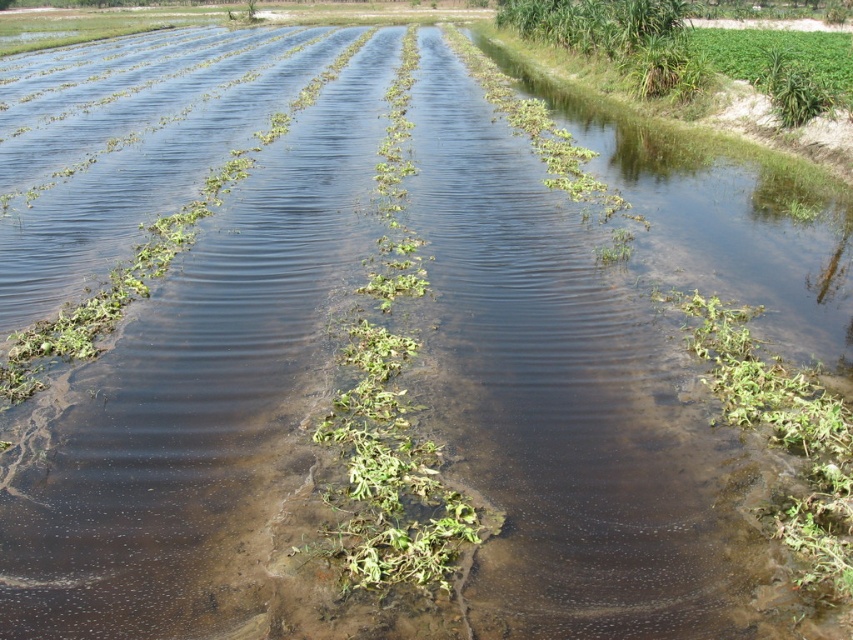
Can you confirm if green leafy plant at center is positioned below green leafy plant at lower right?

Actually, green leafy plant at center is above green leafy plant at lower right.

Does green leafy plant at center have a greater height compared to green leafy plant at lower right?

Yes.

At what (x,y) coordinates should I click in order to perform the action: click on green leafy plant at center. Please return your answer as a coordinate pair (x, y). Looking at the image, I should click on (392, 474).

At what (x,y) coordinates should I click in order to perform the action: click on green leafy plant at center. Please return your answer as a coordinate pair (x, y). This screenshot has width=853, height=640. Looking at the image, I should click on (392, 474).